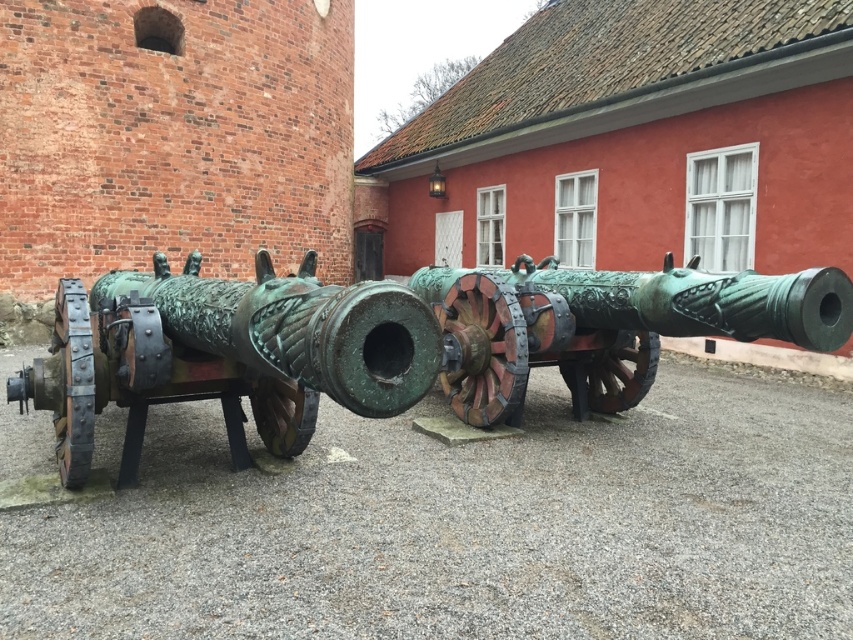
Who is lower down, green patina bronze cannon at left or bronze textured cannon at center?

green patina bronze cannon at left is below.

Between green patina bronze cannon at left and bronze textured cannon at center, which one appears on the left side from the viewer's perspective?

From the viewer's perspective, green patina bronze cannon at left appears more on the left side.

Between point (128, 333) and point (759, 300), which one is positioned in front?

Point (128, 333) is in front.

The height and width of the screenshot is (640, 853). Identify the location of green patina bronze cannon at left. [225, 355].